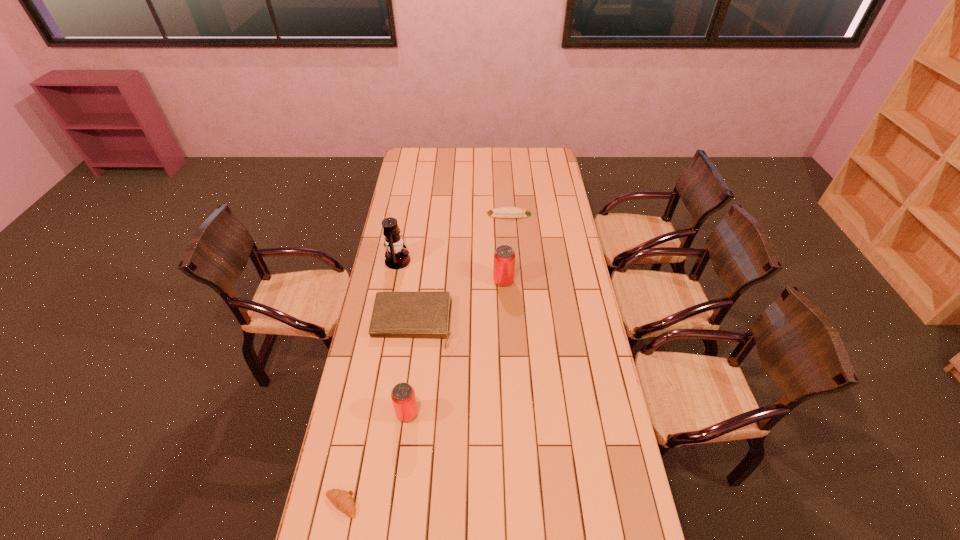
Locate an element on the screen. This screenshot has width=960, height=540. free space that is in between the burrito and the crescent roll is located at coordinates (425, 359).

Find the location of a particular element. The height and width of the screenshot is (540, 960). unoccupied position between the paperback book and the farthest object is located at coordinates (461, 269).

Find the location of `vacant space that's between the left can and the second tallest object`. vacant space that's between the left can and the second tallest object is located at coordinates (455, 347).

Locate an element on the screen. Image resolution: width=960 pixels, height=540 pixels. vacant area between the crescent roll and the burrito is located at coordinates (425, 359).

Find the location of a particular element. Image resolution: width=960 pixels, height=540 pixels. empty location between the lantern and the burrito is located at coordinates (453, 238).

In order to click on free area in between the left can and the burrito in this screenshot , I will do `click(458, 314)`.

Where is `the third closest object relative to the tallest object`? Image resolution: width=960 pixels, height=540 pixels. the third closest object relative to the tallest object is located at coordinates (503, 212).

The height and width of the screenshot is (540, 960). I want to click on object that is the closest one to the fifth shortest object, so click(395, 314).

Identify the location of vacant position in the image that satisfies the following two spatial constraints: 1. on the side of the second farthest object, there is a wick adjustment knob; 2. on the left side of the taller can. (394, 281).

At what (x,y) coordinates should I click in order to perform the action: click on vacant space that satisfies the following two spatial constraints: 1. at the bitten end of the burrito; 2. on the spine side of the third nearest object. Please return your answer as a coordinate pair (x, y). This screenshot has height=540, width=960. Looking at the image, I should click on [x=517, y=325].